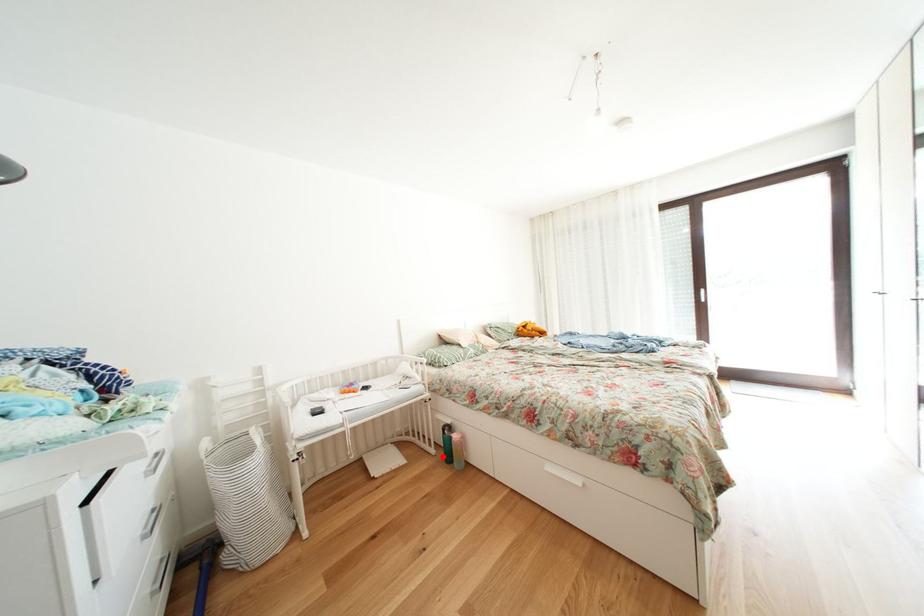
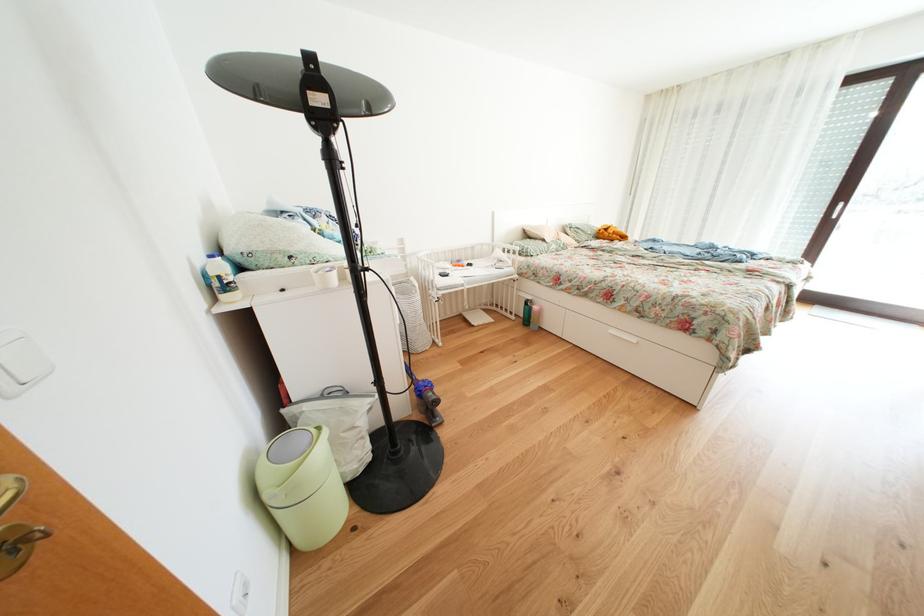
Locate, in the second image, the point that corresponds to the highlighted location in the first image.

(523, 323)